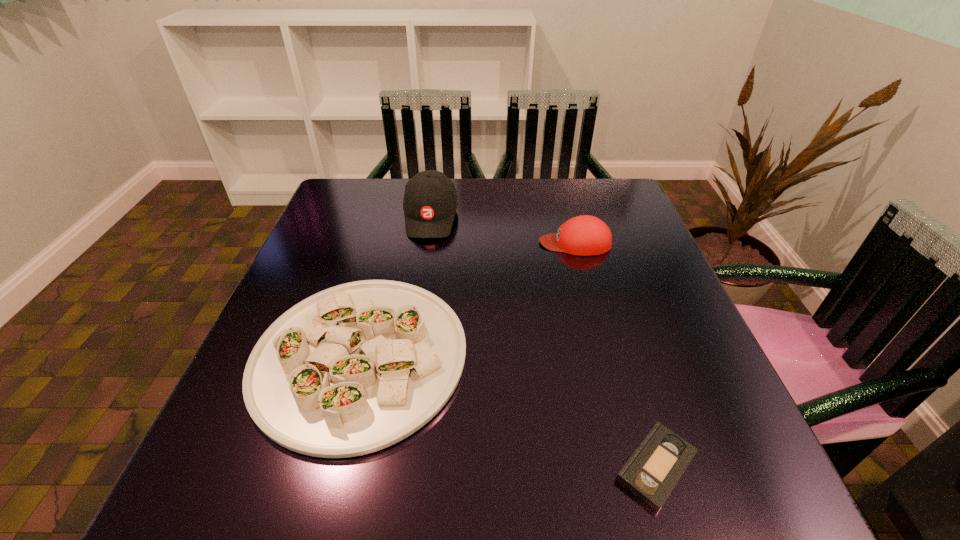
What are the coordinates of `the left baseball cap` in the screenshot? It's located at (430, 202).

At what (x,y) coordinates should I click in order to perform the action: click on the tallest object. Please return your answer as a coordinate pair (x, y). The image size is (960, 540). Looking at the image, I should click on (430, 202).

This screenshot has width=960, height=540. In order to click on the right baseball cap in this screenshot , I will do `click(585, 235)`.

Image resolution: width=960 pixels, height=540 pixels. I want to click on platter, so 353,369.

What are the coordinates of `videotape` in the screenshot? It's located at (651, 473).

Find the location of `vacant region located with a logo on the front of the left baseball cap`. vacant region located with a logo on the front of the left baseball cap is located at coordinates (423, 265).

Locate an element on the screen. This screenshot has height=540, width=960. free space located on the front-facing side of the right baseball cap is located at coordinates (390, 242).

Find the location of a particular element. The image size is (960, 540). free space located on the front-facing side of the right baseball cap is located at coordinates (487, 242).

Locate an element on the screen. The image size is (960, 540). vacant space located 0.290m on the front-facing side of the right baseball cap is located at coordinates (422, 242).

Where is `free region located on the right of the platter`? This screenshot has width=960, height=540. free region located on the right of the platter is located at coordinates (552, 357).